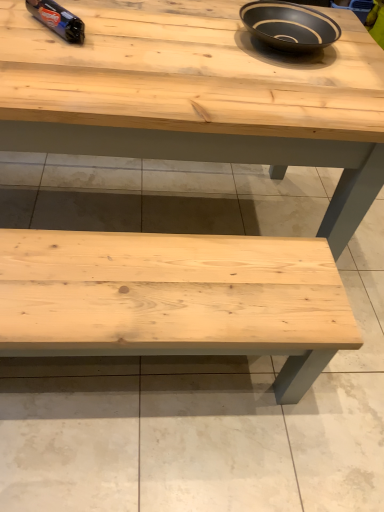
Where is `natural wood table at center`? natural wood table at center is located at coordinates (197, 95).

You are a GUI agent. You are given a task and a screenshot of the screen. Output one action in this format:
    pyautogui.click(x=<x>, y=<y>)
    Task: Click on the shiny blue plastic bottle at upper left
    This screenshot has width=384, height=512.
    Given the screenshot: What is the action you would take?
    pyautogui.click(x=58, y=19)

From a real-world perspective, who is located lower, natural wood table at center or black matte bowl at upper center?

natural wood table at center.

Considering the relative sizes of natural wood table at center and black matte bowl at upper center in the image provided, is natural wood table at center thinner than black matte bowl at upper center?

No.

Based on their sizes in the image, would you say natural wood table at center is bigger or smaller than black matte bowl at upper center?

Clearly, natural wood table at center is larger in size than black matte bowl at upper center.

Which object is positioned more to the right, natural wood bench at bottom or natural wood table at center?

natural wood bench at bottom.

In the scene shown: From the image's perspective, which one is positioned lower, natural wood bench at bottom or natural wood table at center?

natural wood bench at bottom, from the image's perspective.

Are natural wood bench at bottom and natural wood table at center beside each other?

No, natural wood bench at bottom is not making contact with natural wood table at center.

How different are the orientations of natural wood bench at bottom and natural wood table at center in degrees?

The angle between the facing direction of natural wood bench at bottom and the facing direction of natural wood table at center is 179 degrees.

Considering the sizes of objects shiny blue plastic bottle at upper left and natural wood table at center in the image provided, who is smaller, shiny blue plastic bottle at upper left or natural wood table at center?

With smaller size is shiny blue plastic bottle at upper left.

Is shiny blue plastic bottle at upper left far away from natural wood table at center?

No, shiny blue plastic bottle at upper left is not far away from natural wood table at center.

Locate an element on the screen. The height and width of the screenshot is (512, 384). bottle positioned vertically above the natural wood table at center (from a real-world perspective) is located at coordinates (58, 19).

Based on the photo, from the image's perspective, is shiny blue plastic bottle at upper left located above or below natural wood table at center?

shiny blue plastic bottle at upper left is above natural wood table at center.

From the image's perspective, is natural wood table at center above or below natural wood bench at bottom?

Clearly, from the image's perspective, natural wood table at center is above natural wood bench at bottom.

What's the angular difference between natural wood table at center and natural wood bench at bottom's facing directions?

179 degrees.

At what (x,y) coordinates should I click in order to perform the action: click on concrete below the natural wood table at center (from a real-world perspective). Please return your answer as a coordinate pair (x, y). Looking at the image, I should click on (203, 423).

Can you see natural wood table at center touching natural wood bench at bottom?

natural wood table at center and natural wood bench at bottom are clearly separated.

From the image's perspective, between black matte bowl at upper center and shiny blue plastic bottle at upper left, which one is located above?

black matte bowl at upper center, from the image's perspective.

From a real-world perspective, between black matte bowl at upper center and shiny blue plastic bottle at upper left, who is vertically higher?

black matte bowl at upper center, from a real-world perspective.

Is black matte bowl at upper center to the left or to the right of shiny blue plastic bottle at upper left in the image?

Based on their positions, black matte bowl at upper center is located to the right of shiny blue plastic bottle at upper left.

Is natural wood bench at bottom at the back of black matte bowl at upper center?

No, black matte bowl at upper center's orientation is not away from natural wood bench at bottom.

From the image's perspective, is black matte bowl at upper center over natural wood bench at bottom?

Yes, from the image's perspective, black matte bowl at upper center is on top of natural wood bench at bottom.

Which object is wider, black matte bowl at upper center or natural wood bench at bottom?

natural wood bench at bottom is wider.

Is natural wood table at center a part of black matte bowl at upper center?

That's incorrect, natural wood table at center is not inside black matte bowl at upper center.

Is black matte bowl at upper center closer to camera compared to natural wood table at center?

No.

From a real-world perspective, is black matte bowl at upper center physically located above or below natural wood table at center?

In terms of real-world spatial position, black matte bowl at upper center is above natural wood table at center.

Is point (250, 20) closer to camera compared to point (71, 60)?

No, (250, 20) is behind (71, 60).

Where is `bowl above the natural wood table at center (from the image's perspective)`? bowl above the natural wood table at center (from the image's perspective) is located at coordinates (289, 25).

Where is `concrete directly beneath the natural wood table at center (from a real-world perspective)`? This screenshot has height=512, width=384. concrete directly beneath the natural wood table at center (from a real-world perspective) is located at coordinates (203, 423).

Which object lies nearer to the anchor point natural wood bench at bottom, natural wood table at center or black matte bowl at upper center?

Based on the image, natural wood table at center appears to be nearer to natural wood bench at bottom.

Based on their spatial positions, is black matte bowl at upper center or shiny blue plastic bottle at upper left closer to natural wood bench at bottom?

black matte bowl at upper center.

When comparing their distances from natural wood bench at bottom, does shiny blue plastic bottle at upper left or black matte bowl at upper center seem closer?

The object closer to natural wood bench at bottom is black matte bowl at upper center.

Based on their spatial positions, is natural wood bench at bottom or black matte bowl at upper center closer to natural wood table at center?

The object closer to natural wood table at center is black matte bowl at upper center.

From the image, which object appears to be farther from natural wood bench at bottom, natural wood table at center or shiny blue plastic bottle at upper left?

Among the two, shiny blue plastic bottle at upper left is located further to natural wood bench at bottom.

Considering their positions, is black matte bowl at upper center positioned closer to natural wood table at center than shiny blue plastic bottle at upper left?

black matte bowl at upper center is positioned closer to the anchor natural wood table at center.

When comparing their distances from shiny blue plastic bottle at upper left, does natural wood bench at bottom or black matte bowl at upper center seem further?

natural wood bench at bottom.

Looking at the image, which one is located closer to shiny blue plastic bottle at upper left, natural wood table at center or natural wood bench at bottom?

The object closer to shiny blue plastic bottle at upper left is natural wood table at center.

Where is `bottle that lies between black matte bowl at upper center and natural wood bench at bottom from top to bottom`? The image size is (384, 512). bottle that lies between black matte bowl at upper center and natural wood bench at bottom from top to bottom is located at coordinates (58, 19).

Identify the location of table between black matte bowl at upper center and natural wood bench at bottom in the up-down direction. The image size is (384, 512). (197, 95).

Image resolution: width=384 pixels, height=512 pixels. In order to click on table between shiny blue plastic bottle at upper left and black matte bowl at upper center from left to right in this screenshot , I will do `click(197, 95)`.

Find the location of a particular element. table between shiny blue plastic bottle at upper left and natural wood bench at bottom from top to bottom is located at coordinates (197, 95).